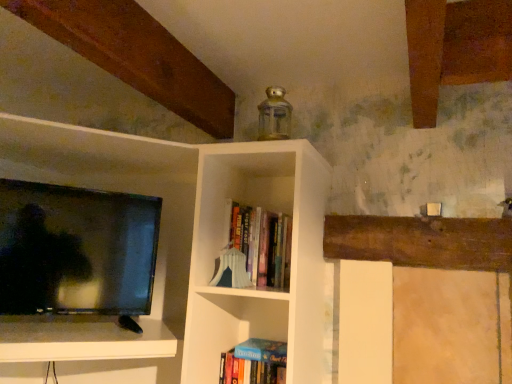
Question: From the image's perspective, is hardcover books at center, which is the first book from top to bottom, positioned above or below hardcover book at lower center, which ranks as the 2th book in top-to-bottom order?

Choices:
 (A) above
 (B) below

Answer: (A)

Question: Looking at the image, does hardcover books at center, which is the first book from top to bottom, seem bigger or smaller compared to hardcover book at lower center, which ranks as the 2th book in top-to-bottom order?

Choices:
 (A) big
 (B) small

Answer: (A)

Question: Considering the positions of hardcover books at center, which is the first book from top to bottom, and hardcover book at lower center, which ranks as the 2th book in top-to-bottom order, in the image, is hardcover books at center, which is the first book from top to bottom, wider or thinner than hardcover book at lower center, which ranks as the 2th book in top-to-bottom order,?

Choices:
 (A) wide
 (B) thin

Answer: (B)

Question: From a real-world perspective, relative to hardcover books at center, which is the first book from top to bottom, is hardcover book at lower center, arranged as the 1th book when ordered from the bottom, vertically above or below?

Choices:
 (A) below
 (B) above

Answer: (A)

Question: Would you say hardcover book at lower center, which ranks as the 2th book in top-to-bottom order, is inside or outside hardcover books at center, the 2th book when ordered from bottom to top?

Choices:
 (A) inside
 (B) outside

Answer: (B)

Question: From the image's perspective, relative to hardcover books at center, which is the first book from top to bottom, is hardcover book at lower center, arranged as the 1th book when ordered from the bottom, above or below?

Choices:
 (A) below
 (B) above

Answer: (A)

Question: Looking at the image, does hardcover book at lower center, which ranks as the 2th book in top-to-bottom order, seem bigger or smaller compared to hardcover books at center, which is the first book from top to bottom?

Choices:
 (A) big
 (B) small

Answer: (B)